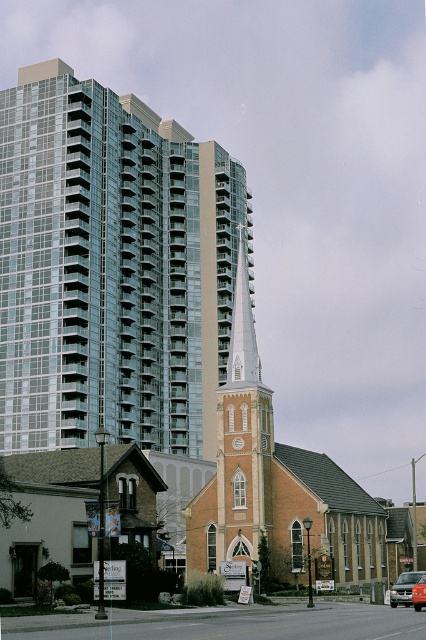
Is brick church at center to the left of orange matte car at center from the viewer's perspective?

Indeed, brick church at center is positioned on the left side of orange matte car at center.

Who is more forward, (235,492) or (411,595)?

Point (411,595) is more forward.

The image size is (426, 640). What do you see at coordinates (276, 488) in the screenshot?
I see `brick church at center` at bounding box center [276, 488].

At what (x,y) coordinates should I click in order to perform the action: click on brick church at center. Please return your answer as a coordinate pair (x, y). The width and height of the screenshot is (426, 640). Looking at the image, I should click on (276, 488).

Which is below, smooth white spire at center or metallic silver van at center?

metallic silver van at center

Which is above, smooth white spire at center or metallic silver van at center?

smooth white spire at center

What do you see at coordinates (242, 330) in the screenshot?
I see `smooth white spire at center` at bounding box center [242, 330].

The width and height of the screenshot is (426, 640). I want to click on smooth white spire at center, so click(242, 330).

Can you confirm if smooth white spire at center is positioned above orange matte car at center?

Yes, smooth white spire at center is above orange matte car at center.

This screenshot has height=640, width=426. I want to click on smooth white spire at center, so click(242, 330).